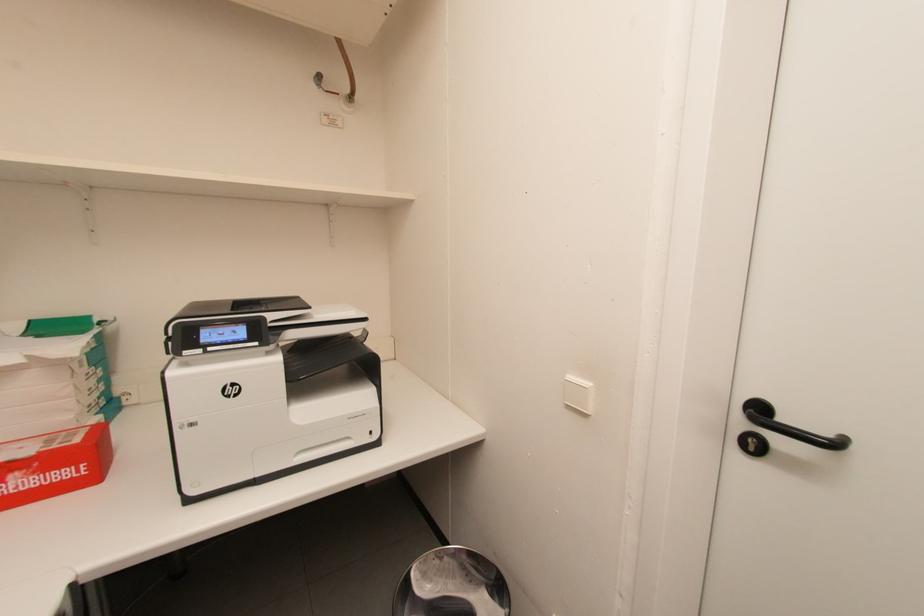
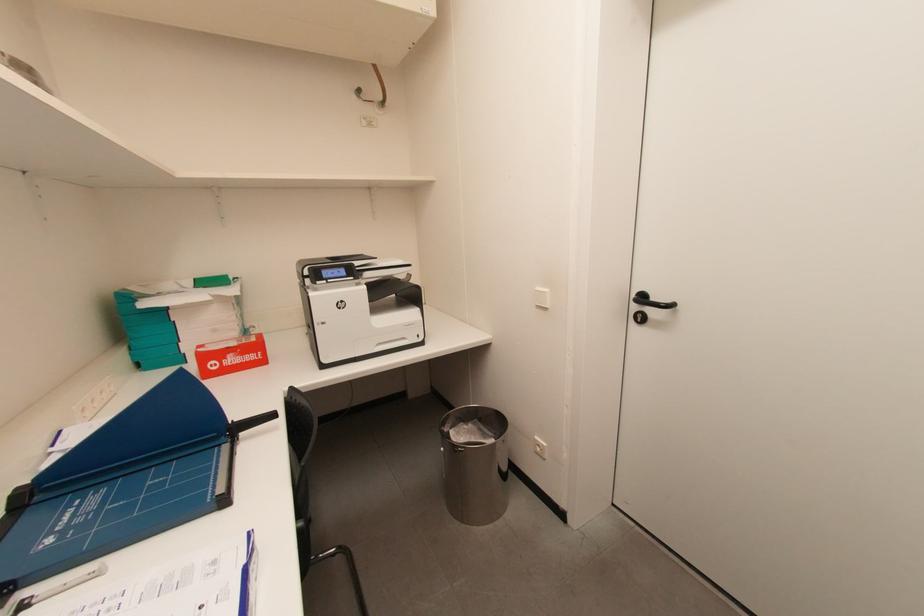
Question: In a continuous first-person perspective shot, in which direction is the camera moving?

Choices:
 (A) Left
 (B) Right
 (C) Forward
 (D) Backward

Answer: (D)